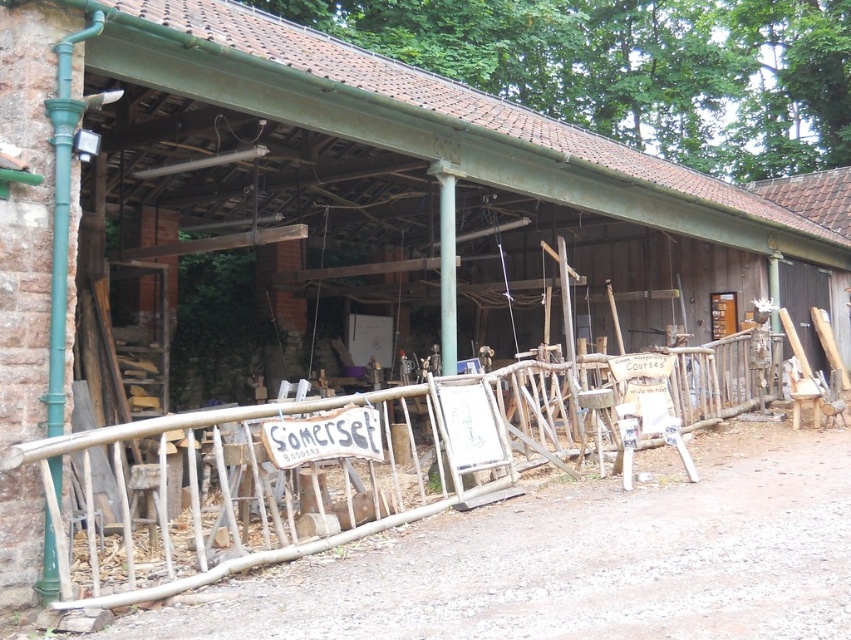
Question: Which point appears closest to the camera in this image?

Choices:
 (A) (412, 461)
 (B) (326, 442)

Answer: (B)

Question: Which point is farther to the camera?

Choices:
 (A) [767, 333]
 (B) [273, 460]

Answer: (A)

Question: Is wooden at center bigger than wooden signboard at center?

Choices:
 (A) no
 (B) yes

Answer: (B)

Question: Can you confirm if wooden at center is positioned below wooden signboard at center?

Choices:
 (A) no
 (B) yes

Answer: (B)

Question: Is the position of wooden at center less distant than that of wooden signboard at center?

Choices:
 (A) no
 (B) yes

Answer: (B)